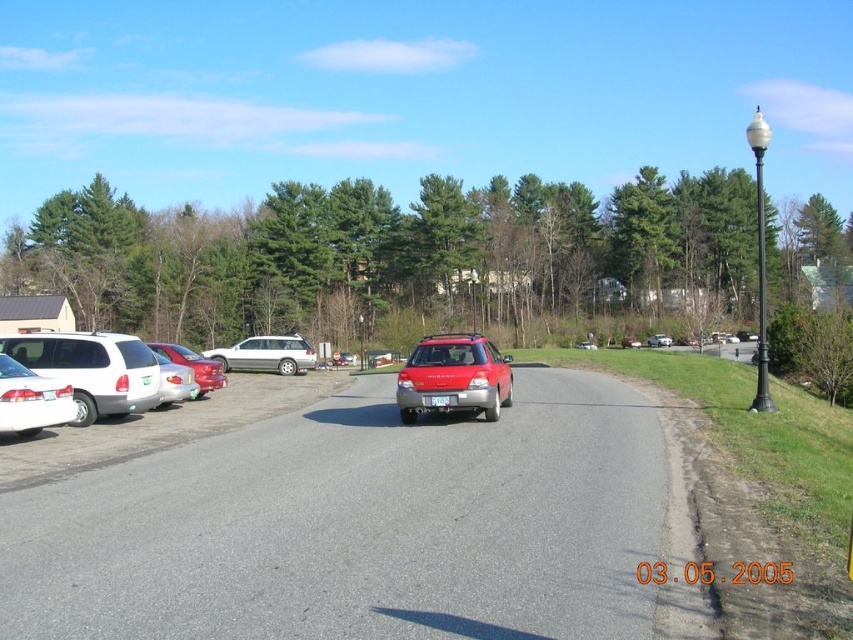
In the scene shown: You are a pedestrian standing at the edge of the road. You see a matte red station wagon at center and a satin silver sedan at center. Which vehicle is closer to you?

The matte red station wagon at center is closer to the viewer than the satin silver sedan at center.

You are a pedestrian standing on the sidewalk and want to cross the road to reach the black lamppost on the right. There are two cars in your view, the metallic silver car at center and the shiny red sedan at left. Which car is closer to you as you prepare to cross?

The metallic silver car at center is closer to you because it is in front of the shiny red sedan at left, meaning it is nearer to your position on the sidewalk.